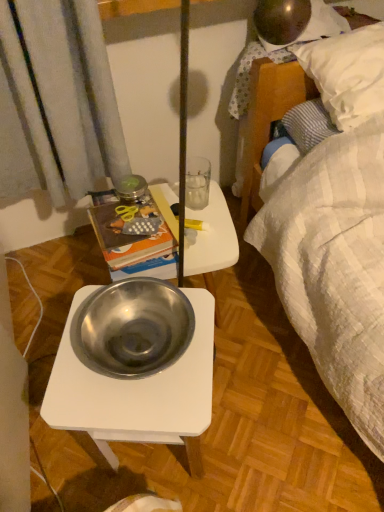
Question: Should I look upward or downward to see polished stainless steel bowl at center?

Choices:
 (A) down
 (B) up

Answer: (A)

Question: Is metallic silver bowl at center shorter than polished stainless steel bowl at center?

Choices:
 (A) no
 (B) yes

Answer: (A)

Question: Does metallic silver bowl at center have a greater height compared to polished stainless steel bowl at center?

Choices:
 (A) yes
 (B) no

Answer: (A)

Question: Is metallic silver bowl at center looking in the opposite direction of polished stainless steel bowl at center?

Choices:
 (A) no
 (B) yes

Answer: (A)

Question: Does metallic silver bowl at center have a smaller size compared to polished stainless steel bowl at center?

Choices:
 (A) no
 (B) yes

Answer: (A)

Question: Is metallic silver bowl at center positioned behind polished stainless steel bowl at center?

Choices:
 (A) yes
 (B) no

Answer: (A)

Question: From the image's perspective, would you say metallic silver bowl at center is positioned over polished stainless steel bowl at center?

Choices:
 (A) no
 (B) yes

Answer: (B)

Question: From a real-world perspective, is hardcover book at upper left positioned under polished stainless steel bowl at center based on gravity?

Choices:
 (A) no
 (B) yes

Answer: (B)

Question: From the image's perspective, does hardcover book at upper left appear lower than polished stainless steel bowl at center?

Choices:
 (A) no
 (B) yes

Answer: (A)

Question: Is hardcover book at upper left behind polished stainless steel bowl at center?

Choices:
 (A) no
 (B) yes

Answer: (B)

Question: Is hardcover book at upper left next to polished stainless steel bowl at center and touching it?

Choices:
 (A) no
 (B) yes

Answer: (A)

Question: Is hardcover book at upper left positioned far away from polished stainless steel bowl at center?

Choices:
 (A) yes
 (B) no

Answer: (B)

Question: Does hardcover book at upper left turn towards polished stainless steel bowl at center?

Choices:
 (A) yes
 (B) no

Answer: (A)

Question: Can you confirm if polished stainless steel bowl at center is smaller than hardcover book at upper left?

Choices:
 (A) no
 (B) yes

Answer: (B)